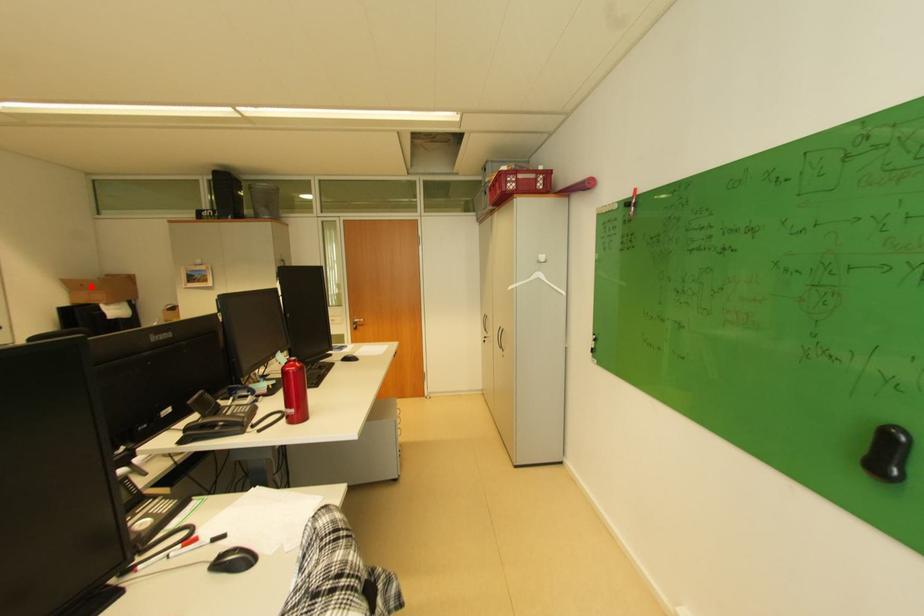
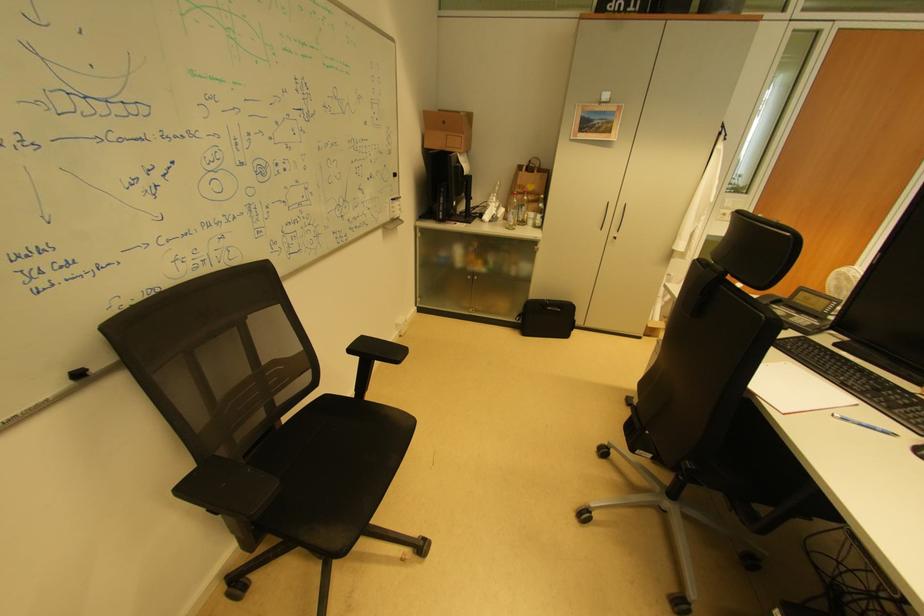
Where in the second image is the point corresponding to the highlighted location from the first image?

(453, 124)